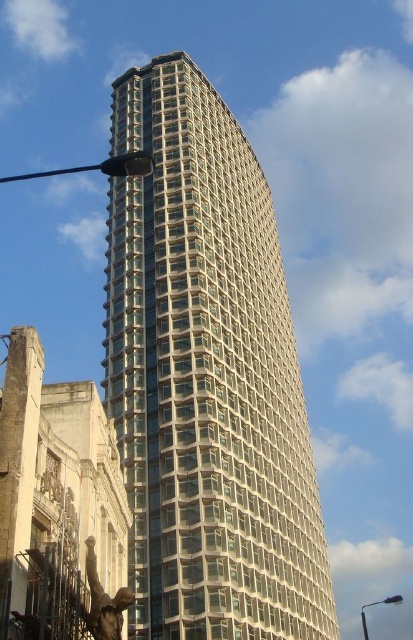
Question: Among these objects, which one is nearest to the camera?

Choices:
 (A) clear glass building at center
 (B) black metal pole at left

Answer: (B)

Question: Is the position of clear glass building at center less distant than that of black metal pole at left?

Choices:
 (A) yes
 (B) no

Answer: (B)

Question: Does clear glass building at center appear on the left side of black metal pole at left?

Choices:
 (A) yes
 (B) no

Answer: (B)

Question: Can you confirm if clear glass building at center is positioned to the left of black metal pole at left?

Choices:
 (A) no
 (B) yes

Answer: (A)